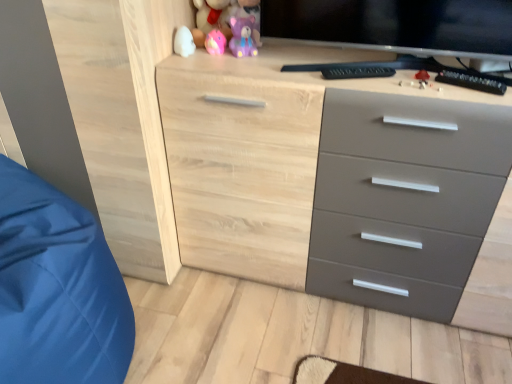
Question: Considering the relative positions of natural wood chest of drawers at center and pink rubber duck at upper center, the 2th toy from the top, in the image provided, is natural wood chest of drawers at center to the right of pink rubber duck at upper center, the 2th toy from the top, from the viewer's perspective?

Choices:
 (A) yes
 (B) no

Answer: (A)

Question: Is natural wood chest of drawers at center shorter than pink rubber duck at upper center, the 2th toy from the top?

Choices:
 (A) no
 (B) yes

Answer: (A)

Question: Can you confirm if natural wood chest of drawers at center is smaller than pink rubber duck at upper center, marked as the third toy in a bottom-to-top arrangement?

Choices:
 (A) no
 (B) yes

Answer: (A)

Question: From a real-world perspective, is natural wood chest of drawers at center below pink rubber duck at upper center, marked as the third toy in a bottom-to-top arrangement?

Choices:
 (A) no
 (B) yes

Answer: (B)

Question: Could you tell me if natural wood chest of drawers at center is turned towards pink rubber duck at upper center, the 2th toy from the top?

Choices:
 (A) yes
 (B) no

Answer: (B)

Question: Do you think pink rubber duck at upper center, the 2th toy from the top, is within purple matte bear at upper center, the 3th toy from the top, or outside of it?

Choices:
 (A) inside
 (B) outside

Answer: (B)

Question: Is pink rubber duck at upper center, marked as the third toy in a bottom-to-top arrangement, to the left or to the right of purple matte bear at upper center, the 3th toy from the top, in the image?

Choices:
 (A) left
 (B) right

Answer: (A)

Question: Considering the positions of pink rubber duck at upper center, marked as the third toy in a bottom-to-top arrangement, and purple matte bear at upper center, the 3th toy from the top, in the image, is pink rubber duck at upper center, marked as the third toy in a bottom-to-top arrangement, taller or shorter than purple matte bear at upper center, the 3th toy from the top,?

Choices:
 (A) tall
 (B) short

Answer: (B)

Question: Considering their positions, is pink rubber duck at upper center, marked as the third toy in a bottom-to-top arrangement, located in front of or behind purple matte bear at upper center, the 3th toy from the top?

Choices:
 (A) front
 (B) behind

Answer: (B)

Question: Considering the positions of point (214, 13) and point (246, 16), is point (214, 13) closer or farther from the camera than point (246, 16)?

Choices:
 (A) closer
 (B) farther

Answer: (A)

Question: Would you say pink plush bear at upper center, the fourth toy from the bottom, is inside or outside purple matte bear at upper center, the 3th toy from the top?

Choices:
 (A) outside
 (B) inside

Answer: (A)

Question: Is pink plush bear at upper center, the fourth toy from the bottom, in front of or behind purple matte bear at upper center, which ranks as the 2th toy in bottom-to-top order, in the image?

Choices:
 (A) behind
 (B) front

Answer: (A)

Question: In terms of height, does pink plush bear at upper center, the first toy in the top-to-bottom sequence, look taller or shorter compared to purple matte bear at upper center, the 3th toy from the top?

Choices:
 (A) short
 (B) tall

Answer: (B)

Question: Is purple matte bear at upper center, the 3th toy from the top, in front of or behind pink plush bear at upper center, the first toy in the top-to-bottom sequence, in the image?

Choices:
 (A) front
 (B) behind

Answer: (A)

Question: In the image, is purple matte bear at upper center, the 3th toy from the top, on the left side or the right side of pink plush bear at upper center, the first toy in the top-to-bottom sequence?

Choices:
 (A) left
 (B) right

Answer: (B)